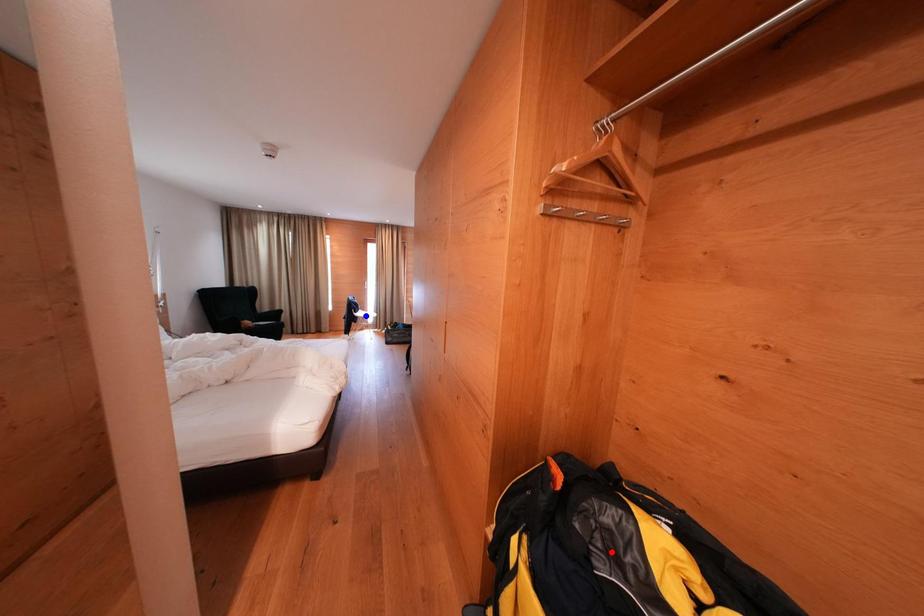
Question: Which of the two points in the image is closer to the camera?

Choices:
 (A) Blue point is closer.
 (B) Red point is closer.

Answer: (B)